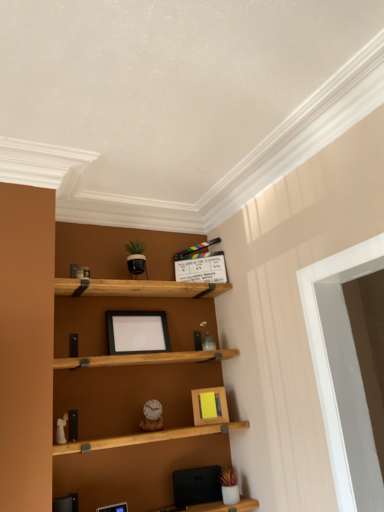
Locate an element on the screen. This screenshot has width=384, height=512. wooden picture frame at center, the first picture frame positioned from the left is located at coordinates (114, 508).

Describe the element at coordinates (209, 406) in the screenshot. The width and height of the screenshot is (384, 512). I see `wooden picture frame at center, which is counted as the 3th picture frame, starting from the left` at that location.

Locate an element on the screen. The height and width of the screenshot is (512, 384). wooden picture frame at center, the third picture frame from the back is located at coordinates 114,508.

Is black matte picture frame at center, arranged as the first picture frame when viewed from the top, at the back of wooden picture frame at center, positioned as the 1th picture frame in front-to-back order?

No, wooden picture frame at center, positioned as the 1th picture frame in front-to-back order, is not facing away from black matte picture frame at center, arranged as the first picture frame when viewed from the top.

Are wooden picture frame at center, positioned as the 1th picture frame in front-to-back order, and black matte picture frame at center, the second picture frame when ordered from right to left, located far from each other?

wooden picture frame at center, positioned as the 1th picture frame in front-to-back order, is actually quite close to black matte picture frame at center, the second picture frame when ordered from right to left.

Can you tell me how much wooden picture frame at center, the first picture frame positioned from the left, and black matte picture frame at center, the second picture frame when ordered from right to left, differ in facing direction?

5.14 degrees separate the facing orientations of wooden picture frame at center, the first picture frame positioned from the left, and black matte picture frame at center, the second picture frame when ordered from right to left.

Does wooden picture frame at center, the first picture frame positioned from the left, contain black matte picture frame at center, the second picture frame when ordered from right to left?

Definitely not — black matte picture frame at center, the second picture frame when ordered from right to left, is not inside wooden picture frame at center, the first picture frame positioned from the left.

Considering the sizes of objects black matte picture frame at center, the 2th picture frame in the front-to-back sequence, and wooden picture frame at center, positioned as the 1th picture frame in front-to-back order, in the image provided, who is taller, black matte picture frame at center, the 2th picture frame in the front-to-back sequence, or wooden picture frame at center, positioned as the 1th picture frame in front-to-back order,?

black matte picture frame at center, the 2th picture frame in the front-to-back sequence, is taller.

In the image, is black matte picture frame at center, the third picture frame when ordered from bottom to top, on the left side or the right side of wooden picture frame at center, the first picture frame positioned from the left?

From the image, it's evident that black matte picture frame at center, the third picture frame when ordered from bottom to top, is to the right of wooden picture frame at center, the first picture frame positioned from the left.

From the image's perspective, is black matte picture frame at center, arranged as the first picture frame when viewed from the top, above or below wooden picture frame at center, the third picture frame from the back?

Based on their image positions, black matte picture frame at center, arranged as the first picture frame when viewed from the top, is located above wooden picture frame at center, the third picture frame from the back.

Is black matte picture frame at center, the second picture frame when ordered from back to front, located outside wooden picture frame at center, the 3th picture frame from the right?

Yes, black matte picture frame at center, the second picture frame when ordered from back to front, is not within wooden picture frame at center, the 3th picture frame from the right.

In the scene shown: Which is more to the left, black matte picture frame at center, which is the second picture frame in left-to-right order, or wooden picture frame at center, which appears as the third picture frame when viewed from the front?

black matte picture frame at center, which is the second picture frame in left-to-right order.

Does black matte picture frame at center, arranged as the first picture frame when viewed from the top, have a greater height compared to wooden picture frame at center, which appears as the third picture frame when viewed from the front?

Yes, black matte picture frame at center, arranged as the first picture frame when viewed from the top, is taller than wooden picture frame at center, which appears as the third picture frame when viewed from the front.

From a real-world perspective, is black matte picture frame at center, the 2th picture frame in the front-to-back sequence, positioned above or below wooden picture frame at center, which appears as the first picture frame when viewed from the right?

black matte picture frame at center, the 2th picture frame in the front-to-back sequence, is situated higher than wooden picture frame at center, which appears as the first picture frame when viewed from the right, in the real world.

Can you confirm if black matte picture frame at center, the second picture frame when ordered from back to front, is wider than wooden picture frame at center, which appears as the third picture frame when viewed from the front?

Correct, the width of black matte picture frame at center, the second picture frame when ordered from back to front, exceeds that of wooden picture frame at center, which appears as the third picture frame when viewed from the front.

Is wooden picture frame at center, which appears as the first picture frame when viewed from the back, inside or outside of wooden picture frame at center, positioned as the 1th picture frame in front-to-back order?

wooden picture frame at center, which appears as the first picture frame when viewed from the back, is not enclosed by wooden picture frame at center, positioned as the 1th picture frame in front-to-back order.

Considering the relative sizes of wooden picture frame at center, which is counted as the 3th picture frame, starting from the left, and wooden picture frame at center, the 3th picture frame from the right, in the image provided, is wooden picture frame at center, which is counted as the 3th picture frame, starting from the left, thinner than wooden picture frame at center, the 3th picture frame from the right,?

Correct, the width of wooden picture frame at center, which is counted as the 3th picture frame, starting from the left, is less than that of wooden picture frame at center, the 3th picture frame from the right.

Is wooden picture frame at center, placed as the 2th picture frame when sorted from top to bottom, oriented away from wooden picture frame at center, the third picture frame from the back?

No, wooden picture frame at center, placed as the 2th picture frame when sorted from top to bottom,'s orientation is not away from wooden picture frame at center, the third picture frame from the back.

Is wooden picture frame at center, which is counted as the 3th picture frame, starting from the left, positioned in front of wooden picture frame at center, which is counted as the 3th picture frame, starting from the top?

No, wooden picture frame at center, which is counted as the 3th picture frame, starting from the left, is behind wooden picture frame at center, which is counted as the 3th picture frame, starting from the top.

Is point (113, 339) positioned before point (305, 312)?

No.

Is black matte picture frame at center, the third picture frame when ordered from bottom to top, not inside white glossy door at right?

Yes, black matte picture frame at center, the third picture frame when ordered from bottom to top, is outside of white glossy door at right.

Who is shorter, black matte picture frame at center, the second picture frame when ordered from right to left, or white glossy door at right?

black matte picture frame at center, the second picture frame when ordered from right to left.

Can you confirm if white glossy door at right is wider than black matte picture frame at center, which is the second picture frame in left-to-right order?

Indeed, white glossy door at right has a greater width compared to black matte picture frame at center, which is the second picture frame in left-to-right order.

Could you tell me if white glossy door at right is turned towards black matte picture frame at center, the third picture frame when ordered from bottom to top?

No, white glossy door at right is not turned towards black matte picture frame at center, the third picture frame when ordered from bottom to top.

How different are the orientations of white glossy door at right and black matte picture frame at center, the third picture frame when ordered from bottom to top, in degrees?

The facing directions of white glossy door at right and black matte picture frame at center, the third picture frame when ordered from bottom to top, are 2.42 degrees apart.

Is white glossy door at right next to black matte picture frame at center, the second picture frame when ordered from back to front?

No, white glossy door at right is not making contact with black matte picture frame at center, the second picture frame when ordered from back to front.

Is wooden picture frame at center, which is counted as the 3th picture frame, starting from the left, positioned beyond the bounds of white glossy door at right?

wooden picture frame at center, which is counted as the 3th picture frame, starting from the left, is positioned outside white glossy door at right.

I want to click on window in front of the wooden picture frame at center, which appears as the third picture frame when viewed from the front, so click(x=343, y=373).

Consider the image. Does wooden picture frame at center, which appears as the first picture frame when viewed from the back, appear on the right side of white glossy door at right?

In fact, wooden picture frame at center, which appears as the first picture frame when viewed from the back, is to the left of white glossy door at right.

Considering the sizes of objects wooden picture frame at center, placed as the 2th picture frame when sorted from top to bottom, and white glossy door at right in the image provided, who is wider, wooden picture frame at center, placed as the 2th picture frame when sorted from top to bottom, or white glossy door at right?

white glossy door at right is wider.

Where is `picture frame that is the 2nd one when counting upward from the wooden picture frame at center, the 3th picture frame from the right (from the image's perspective)`? The width and height of the screenshot is (384, 512). picture frame that is the 2nd one when counting upward from the wooden picture frame at center, the 3th picture frame from the right (from the image's perspective) is located at coordinates coord(137,332).

Image resolution: width=384 pixels, height=512 pixels. In order to click on the 1st picture frame behind the wooden picture frame at center, the first picture frame when ordered from bottom to top, starting your count from the anchor in this screenshot , I will do `click(137, 332)`.

Which object lies nearer to the anchor point black matte picture frame at center, the 2th picture frame in the front-to-back sequence, wooden picture frame at center, the 2th picture frame in the bottom-to-top sequence, or wooden picture frame at center, the 3th picture frame from the right?

The object closer to black matte picture frame at center, the 2th picture frame in the front-to-back sequence, is wooden picture frame at center, the 2th picture frame in the bottom-to-top sequence.

From the image, which object appears to be nearer to white glossy door at right, black matte picture frame at center, which is the second picture frame in left-to-right order, or wooden picture frame at center, which is counted as the 3th picture frame, starting from the left?

wooden picture frame at center, which is counted as the 3th picture frame, starting from the left, lies closer to white glossy door at right than the other object.

Which object lies further to the anchor point wooden picture frame at center, positioned as the 1th picture frame in front-to-back order, black matte picture frame at center, the second picture frame when ordered from right to left, or white glossy door at right?

white glossy door at right.

From the picture: Considering their positions, is wooden picture frame at center, the first picture frame positioned from the left, positioned closer to white glossy door at right than wooden picture frame at center, which appears as the first picture frame when viewed from the right?

Among the two, wooden picture frame at center, which appears as the first picture frame when viewed from the right, is located nearer to white glossy door at right.

When comparing their distances from wooden picture frame at center, the first picture frame positioned from the left, does white glossy door at right or wooden picture frame at center, which appears as the third picture frame when viewed from the front, seem further?

white glossy door at right.

Considering their positions, is white glossy door at right positioned further to wooden picture frame at center, which is counted as the 3th picture frame, starting from the top, than black matte picture frame at center, the 2th picture frame in the front-to-back sequence?

Based on the image, white glossy door at right appears to be further to wooden picture frame at center, which is counted as the 3th picture frame, starting from the top.

Based on their spatial positions, is black matte picture frame at center, the second picture frame when ordered from back to front, or wooden picture frame at center, which is counted as the 3th picture frame, starting from the top, further from white glossy door at right?

wooden picture frame at center, which is counted as the 3th picture frame, starting from the top, is positioned further to the anchor white glossy door at right.

Considering their positions, is black matte picture frame at center, the second picture frame when ordered from back to front, positioned further to wooden picture frame at center, the 3th picture frame from the right, than wooden picture frame at center, which appears as the third picture frame when viewed from the front?

black matte picture frame at center, the second picture frame when ordered from back to front, is further to wooden picture frame at center, the 3th picture frame from the right.

In order to click on picture frame located between black matte picture frame at center, the second picture frame when ordered from back to front, and white glossy door at right in the left-right direction in this screenshot , I will do `click(209, 406)`.

Where is `picture frame between black matte picture frame at center, which is the second picture frame in left-to-right order, and wooden picture frame at center, the first picture frame positioned from the left, in the vertical direction`? This screenshot has width=384, height=512. picture frame between black matte picture frame at center, which is the second picture frame in left-to-right order, and wooden picture frame at center, the first picture frame positioned from the left, in the vertical direction is located at coordinates (209, 406).